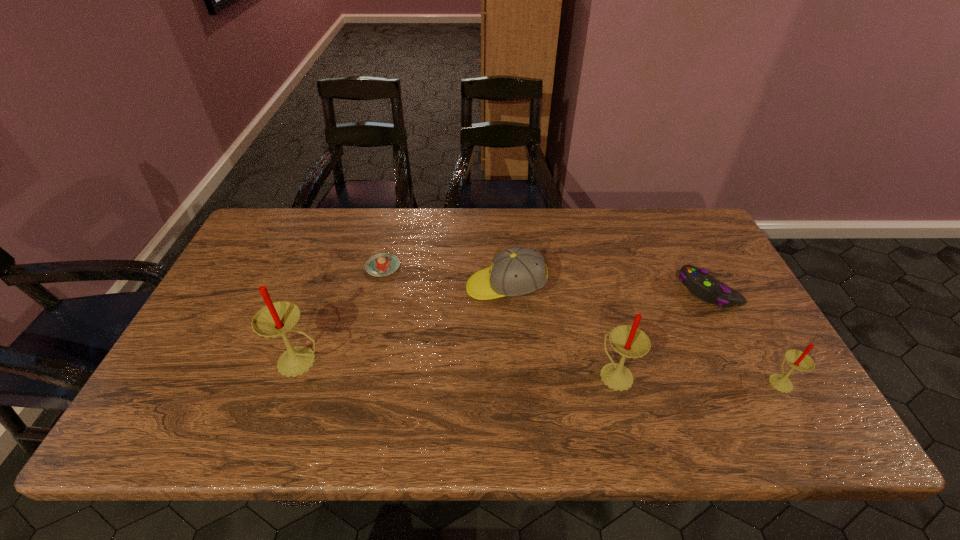
Locate an element on the screen. Image resolution: width=960 pixels, height=540 pixels. free space between the fourth tallest object and the control is located at coordinates [x=607, y=289].

Locate an element on the screen. This screenshot has width=960, height=540. free area in between the fourth object from right to left and the pastry is located at coordinates (444, 277).

The width and height of the screenshot is (960, 540). Identify the location of free space that is in between the leftmost object and the fourth object from right to left. (403, 325).

Locate an element on the screen. This screenshot has height=540, width=960. unoccupied area between the fourth object from right to left and the second shortest object is located at coordinates (607, 289).

The width and height of the screenshot is (960, 540). I want to click on unoccupied position between the rightmost candle and the fifth object from right to left, so click(581, 323).

Identify the location of object that can be found as the third closest to the leftmost object. The width and height of the screenshot is (960, 540). (630, 342).

You are a GUI agent. You are given a task and a screenshot of the screen. Output one action in this format:
    pyautogui.click(x=<x>, y=<y>)
    Task: Click on the object that is the closest to the leftmost candle
    This screenshot has height=540, width=960.
    Given the screenshot: What is the action you would take?
    pyautogui.click(x=383, y=264)

Where is `candle object that ranks as the closest to the shortest candle`? candle object that ranks as the closest to the shortest candle is located at coordinates (630, 342).

Image resolution: width=960 pixels, height=540 pixels. In order to click on candle that stands as the closest to the fourth object from left to right in this screenshot , I will do `click(798, 360)`.

Find the location of a particular element. free region that satisfies the following two spatial constraints: 1. on the front-facing side of the rightmost candle; 2. on the right side of the third object from left to right is located at coordinates (512, 381).